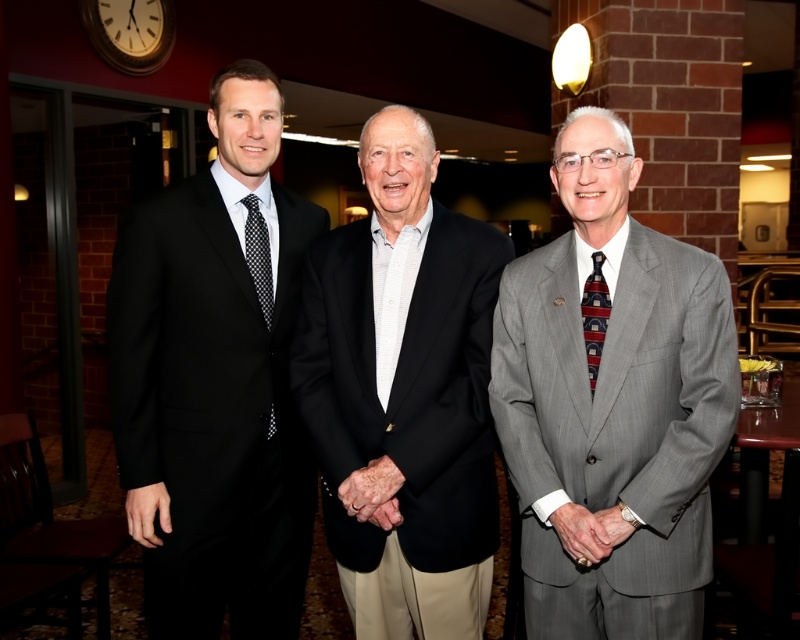
Question: Can you confirm if black dotted tie at left is thinner than striped silk tie at center?

Choices:
 (A) yes
 (B) no

Answer: (B)

Question: Which of the following is the closest to the observer?

Choices:
 (A) (344, 488)
 (B) (592, 369)
 (C) (604, 532)
 (D) (262, 125)

Answer: (C)

Question: Can you confirm if black smooth suit at center is positioned below black dotted tie at left?

Choices:
 (A) no
 (B) yes

Answer: (B)

Question: Which point is farther to the camera?

Choices:
 (A) striped silk tie at center
 (B) silver metallic watch at center

Answer: (A)

Question: Is smooth skin hand at center wider than smooth gray suit at center?

Choices:
 (A) no
 (B) yes

Answer: (B)

Question: Based on their relative distances, which object is farther from the silver metallic watch at center?

Choices:
 (A) black smooth suit at center
 (B) black dotted tie at left
 (C) striped silk tie at center
 (D) smooth skin hand at center

Answer: (B)